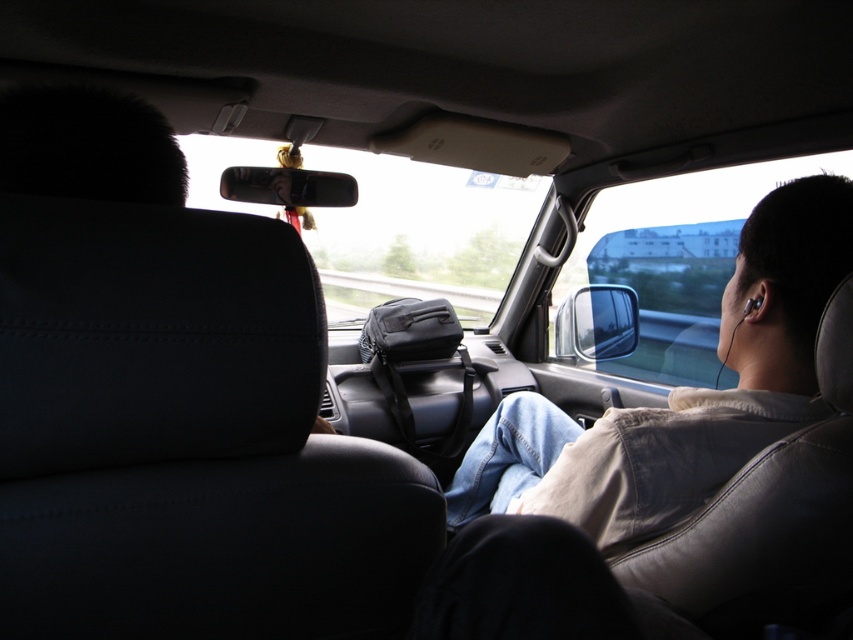
You are a delivery robot that needs to place a package between the light brown leather jacket at right and the black fur at upper left. The package is 30 inches long. Is there enough space to place it there?

The distance between the light brown leather jacket at right and the black fur at upper left is 35.76 inches, so yes, the package can be placed there since it is shorter than the available space.

You are a passenger in the car and want to reach the black fur at upper left that is behind the light brown leather jacket at right. Can you easily access it without moving the jacket?

The black fur at upper left is behind the light brown leather jacket at right, so you cannot easily access it without moving the jacket.

You are a passenger in the car and want to hand a document to the driver. The document is on the light brown leather jacket at right. To reach the driver, do you need to move the black fur at upper left?

The light brown leather jacket at right is to the right of black fur at upper left, so you can reach the driver without moving the black fur at upper left because the jacket is already positioned to the right side of the fur.